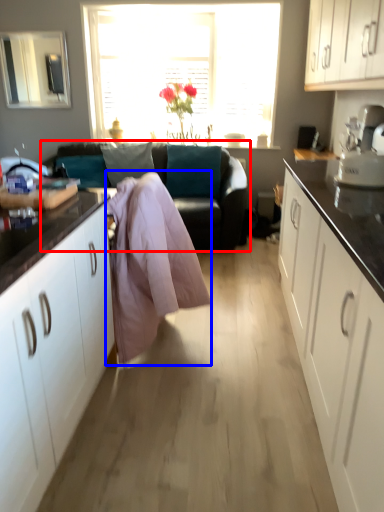
Question: Which of the following is the closest to the observer, studio couch (highlighted by a red box) or blanket (highlighted by a blue box)?

Choices:
 (A) studio couch
 (B) blanket

Answer: (B)